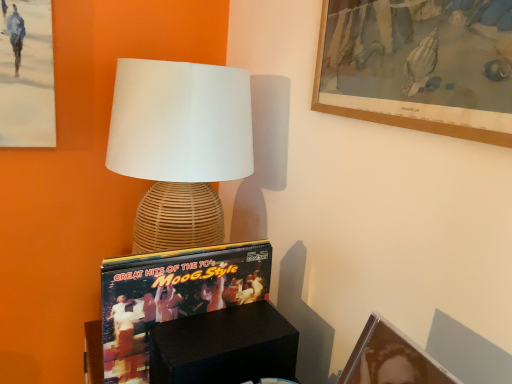
Question: Could wooden picture frame at upper right, the 1th picture frame viewed from the top, be considered to be inside matte black picture frame at lower right, the second picture frame in the top-to-bottom sequence?

Choices:
 (A) no
 (B) yes

Answer: (A)

Question: From a real-world perspective, is matte black picture frame at lower right, the second picture frame in the top-to-bottom sequence, located higher than wooden picture frame at upper right, which is the 2th picture frame from bottom to top?

Choices:
 (A) no
 (B) yes

Answer: (A)

Question: From the image's perspective, is matte black picture frame at lower right, the second picture frame in the top-to-bottom sequence, on wooden picture frame at upper right, which is the 2th picture frame from bottom to top?

Choices:
 (A) no
 (B) yes

Answer: (A)

Question: Does matte black picture frame at lower right, the 1th picture frame in the bottom-to-top sequence, have a greater height compared to wooden picture frame at upper right, which is the 2th picture frame from bottom to top?

Choices:
 (A) no
 (B) yes

Answer: (A)

Question: Can you confirm if matte black picture frame at lower right, the 1th picture frame in the bottom-to-top sequence, is thinner than wooden picture frame at upper right, which is the 2th picture frame from bottom to top?

Choices:
 (A) yes
 (B) no

Answer: (B)

Question: Do you think matte black picture frame at lower right, the second picture frame in the top-to-bottom sequence, is within black matte box at lower center, or outside of it?

Choices:
 (A) outside
 (B) inside

Answer: (A)

Question: From their relative heights in the image, would you say matte black picture frame at lower right, the 1th picture frame in the bottom-to-top sequence, is taller or shorter than black matte box at lower center?

Choices:
 (A) short
 (B) tall

Answer: (A)

Question: In the image, is matte black picture frame at lower right, the 1th picture frame in the bottom-to-top sequence, positioned in front of or behind black matte box at lower center?

Choices:
 (A) front
 (B) behind

Answer: (A)

Question: Does point (431, 374) appear closer or farther from the camera than point (245, 319)?

Choices:
 (A) farther
 (B) closer

Answer: (B)

Question: From a real-world perspective, is matte black picture frame at lower right, the 1th picture frame in the bottom-to-top sequence, above or below woven rattan lamp at center?

Choices:
 (A) above
 (B) below

Answer: (B)

Question: In the image, is matte black picture frame at lower right, the second picture frame in the top-to-bottom sequence, positioned in front of or behind woven rattan lamp at center?

Choices:
 (A) behind
 (B) front

Answer: (B)

Question: From the image's perspective, is matte black picture frame at lower right, the 1th picture frame in the bottom-to-top sequence, located above or below woven rattan lamp at center?

Choices:
 (A) above
 (B) below

Answer: (B)

Question: Is matte black picture frame at lower right, the 1th picture frame in the bottom-to-top sequence, taller or shorter than woven rattan lamp at center?

Choices:
 (A) tall
 (B) short

Answer: (B)

Question: Considering their positions, is matte black picture frame at lower right, the 1th picture frame in the bottom-to-top sequence, located in front of or behind wooden picture frame at upper right, the 1th picture frame viewed from the top?

Choices:
 (A) behind
 (B) front

Answer: (B)

Question: Considering the positions of matte black picture frame at lower right, the second picture frame in the top-to-bottom sequence, and wooden picture frame at upper right, the 1th picture frame viewed from the top, in the image, is matte black picture frame at lower right, the second picture frame in the top-to-bottom sequence, wider or thinner than wooden picture frame at upper right, the 1th picture frame viewed from the top,?

Choices:
 (A) thin
 (B) wide

Answer: (B)